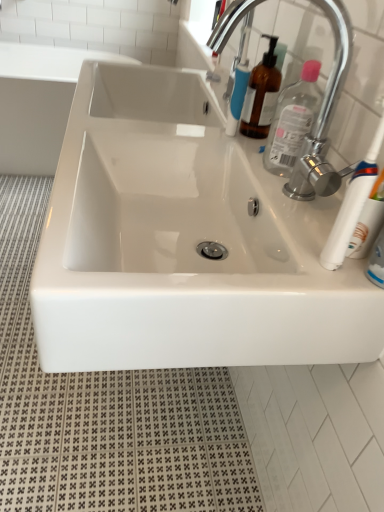
Question: Is chrome metallic faucet at upper right behind white glossy sink at center?

Choices:
 (A) no
 (B) yes

Answer: (A)

Question: From a real-world perspective, is chrome metallic faucet at upper right on top of white glossy sink at center?

Choices:
 (A) no
 (B) yes

Answer: (B)

Question: Does chrome metallic faucet at upper right appear on the right side of white glossy sink at center?

Choices:
 (A) no
 (B) yes

Answer: (B)

Question: Is chrome metallic faucet at upper right closer to camera compared to white glossy sink at center?

Choices:
 (A) no
 (B) yes

Answer: (B)

Question: Considering the relative sizes of chrome metallic faucet at upper right and white glossy sink at center in the image provided, is chrome metallic faucet at upper right shorter than white glossy sink at center?

Choices:
 (A) yes
 (B) no

Answer: (A)

Question: Considering the positions of point coord(375,323) and point coord(1,166), is point coord(375,323) closer or farther from the camera than point coord(1,166)?

Choices:
 (A) closer
 (B) farther

Answer: (A)

Question: From the image's perspective, is white glossy sink at center positioned above or below white glossy sink at upper left?

Choices:
 (A) below
 (B) above

Answer: (A)

Question: Is white glossy sink at center in front of or behind white glossy sink at upper left in the image?

Choices:
 (A) behind
 (B) front

Answer: (B)

Question: From a real-world perspective, is white glossy sink at center physically located above or below white glossy sink at upper left?

Choices:
 (A) above
 (B) below

Answer: (A)

Question: From the image's perspective, is white plastic toothbrush at right positioned above or below clear plastic bottle at upper right?

Choices:
 (A) below
 (B) above

Answer: (A)

Question: From a real-world perspective, is white plastic toothbrush at right physically located above or below clear plastic bottle at upper right?

Choices:
 (A) above
 (B) below

Answer: (A)

Question: Would you say white plastic toothbrush at right is to the left or to the right of clear plastic bottle at upper right in the picture?

Choices:
 (A) right
 (B) left

Answer: (A)

Question: Based on their sizes in the image, would you say white plastic toothbrush at right is bigger or smaller than clear plastic bottle at upper right?

Choices:
 (A) big
 (B) small

Answer: (A)

Question: Would you say clear plastic bottle at upper right is to the left or to the right of white glossy sink at upper left in the picture?

Choices:
 (A) left
 (B) right

Answer: (B)

Question: In terms of height, does clear plastic bottle at upper right look taller or shorter compared to white glossy sink at upper left?

Choices:
 (A) short
 (B) tall

Answer: (A)